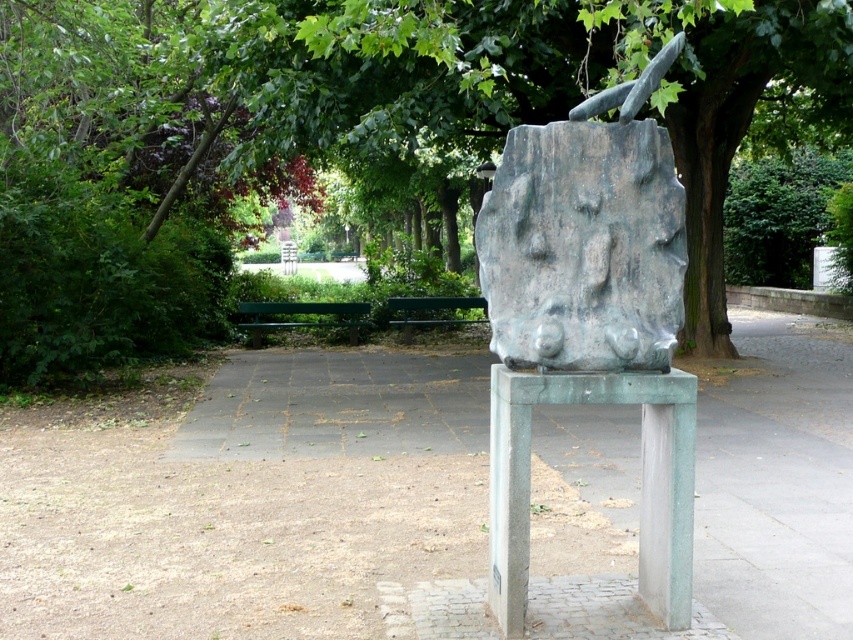
You are standing in front of the sculpture and want to place a small flowerpot between the gray stone sculpture at center and the green patinated stone stool at center. Based on their positions, where should you place the flowerpot?

Since the gray stone sculpture at center is to the left of the green patinated stone stool at center, you should place the flowerpot to the right of the gray stone sculpture at center or to the left of the green patinated stone stool at center to position it between them.

You are an artist planning to place a new artwork between the gray stone sculpture at center and the green patinated stone stool at center. Considering their widths, which object should you position closer to the narrower side to ensure proper spacing?

The green patinated stone stool at center is narrower than the gray stone sculpture at center. Position the new artwork closer to the green patinated stone stool at center to maintain proper spacing between the two objects.